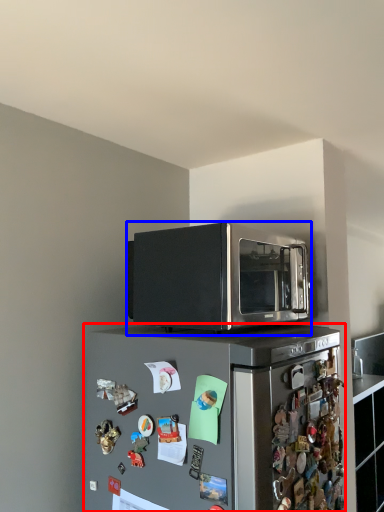
Question: Which point is closer to the camera, refrigerator (highlighted by a red box) or microwave oven (highlighted by a blue box)?

Choices:
 (A) refrigerator
 (B) microwave oven

Answer: (A)